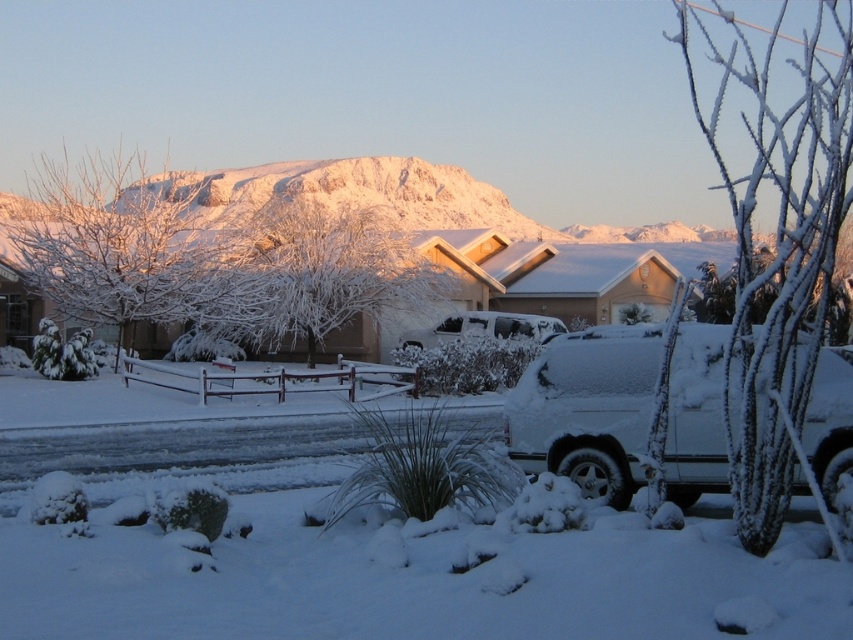
Can you confirm if white matte suv at center is positioned to the left of white matte car at center?

In fact, white matte suv at center is to the right of white matte car at center.

In the scene shown: Between white matte suv at center and white matte car at center, which one is positioned lower?

white matte suv at center is below.

I want to click on white matte suv at center, so click(x=587, y=408).

Image resolution: width=853 pixels, height=640 pixels. I want to click on white matte suv at center, so click(587, 408).